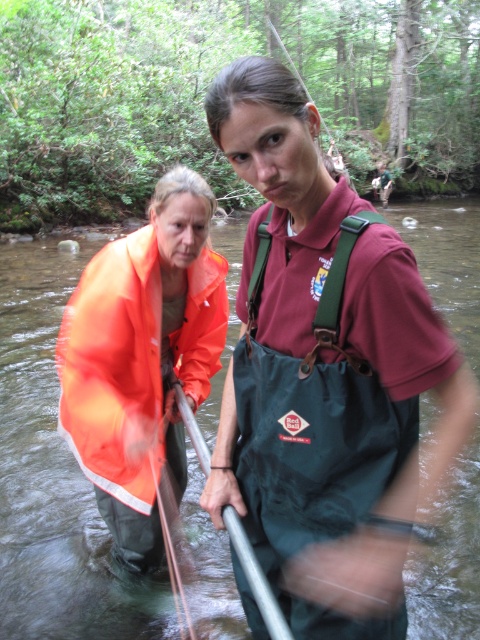
Question: Which of the following is the closest to the observer?

Choices:
 (A) (33, 276)
 (B) (129, 374)
 (C) (277, 147)

Answer: (C)

Question: Which object is closer to the camera taking this photo?

Choices:
 (A) orange waterproof jacket at center
 (B) silver metallic paddle at center

Answer: (B)

Question: Which point is closer to the camera taking this photo?

Choices:
 (A) (456, 243)
 (B) (78, 413)

Answer: (B)

Question: Is maroon fabric shirt at center wider than orange waterproof jacket at center?

Choices:
 (A) no
 (B) yes

Answer: (B)

Question: Does clear water at center appear on the left side of silver metallic paddle at center?

Choices:
 (A) no
 (B) yes

Answer: (A)

Question: Does maroon fabric shirt at center have a lesser width compared to silver metallic paddle at center?

Choices:
 (A) no
 (B) yes

Answer: (A)